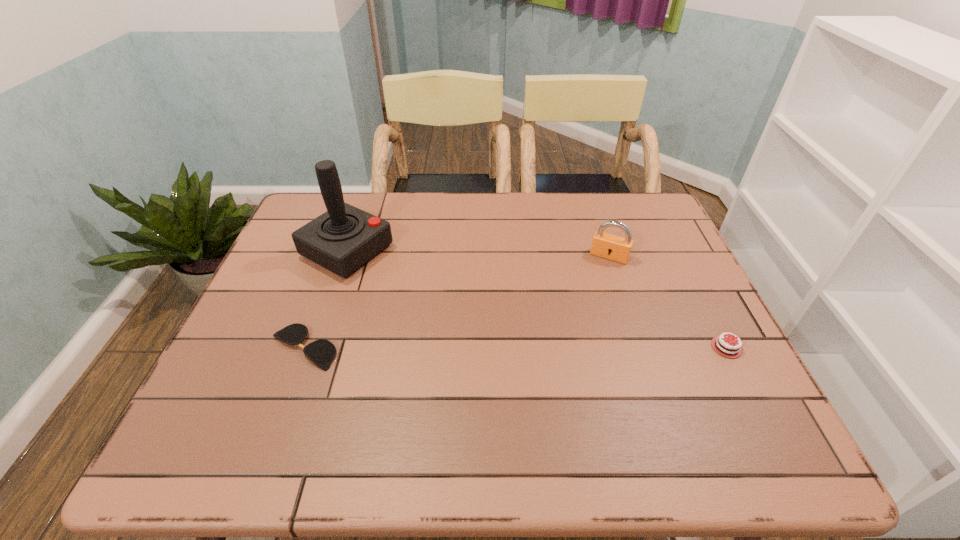
The image size is (960, 540). Identify the location of spectacles. (321, 352).

Locate an element on the screen. This screenshot has width=960, height=540. chocolate cake is located at coordinates (722, 344).

The height and width of the screenshot is (540, 960). What are the coordinates of `the second shortest object` in the screenshot? It's located at (722, 344).

The width and height of the screenshot is (960, 540). I want to click on the tallest object, so click(x=343, y=239).

Identify the location of the third shortest object. Image resolution: width=960 pixels, height=540 pixels. (608, 246).

Where is `padlock`? The height and width of the screenshot is (540, 960). padlock is located at coordinates (608, 246).

Image resolution: width=960 pixels, height=540 pixels. In order to click on free space located on the right of the shortest object in this screenshot , I will do `click(452, 347)`.

I want to click on free space located on the back of the rightmost object, so click(667, 231).

Find the location of `vacant space located on the base of the joystick`. vacant space located on the base of the joystick is located at coordinates (429, 292).

Locate an element on the screen. This screenshot has height=540, width=960. free location located on the base of the joystick is located at coordinates (460, 308).